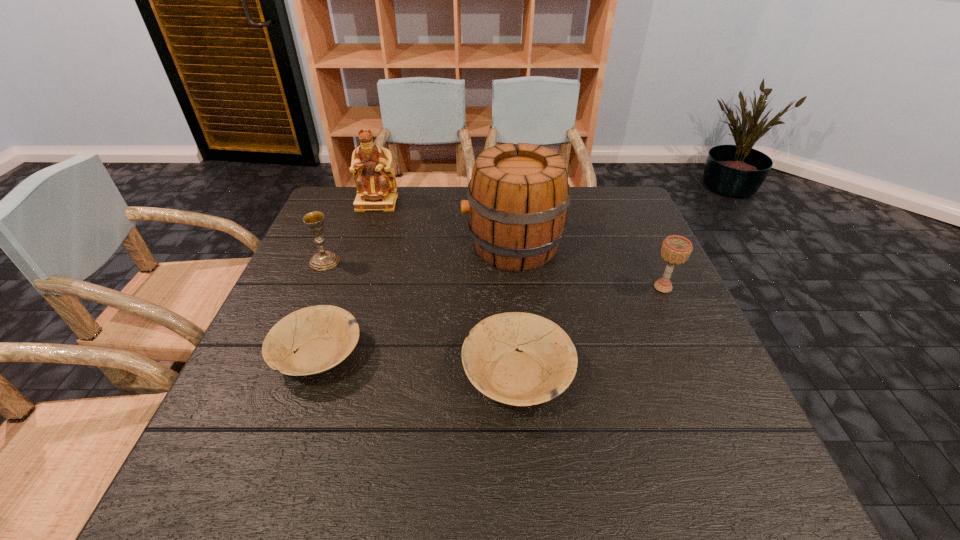
This screenshot has height=540, width=960. I want to click on the shorter bowl, so click(322, 336).

This screenshot has width=960, height=540. Identify the location of the left bowl. (322, 336).

Image resolution: width=960 pixels, height=540 pixels. Identify the location of the right bowl. (543, 367).

Image resolution: width=960 pixels, height=540 pixels. I want to click on the taller bowl, so click(x=543, y=367).

I want to click on cider, so click(x=518, y=198).

Where is `the farthest object`? the farthest object is located at coordinates (375, 181).

Identify the location of the left chalice. This screenshot has width=960, height=540. (324, 260).

The image size is (960, 540). I want to click on the nearer chalice, so click(675, 250).

The image size is (960, 540). What are the coordinates of `the fourth farthest object` in the screenshot? It's located at (675, 250).

Locate an element on the screen. The height and width of the screenshot is (540, 960). vacant region located on the right of the shorter bowl is located at coordinates (468, 355).